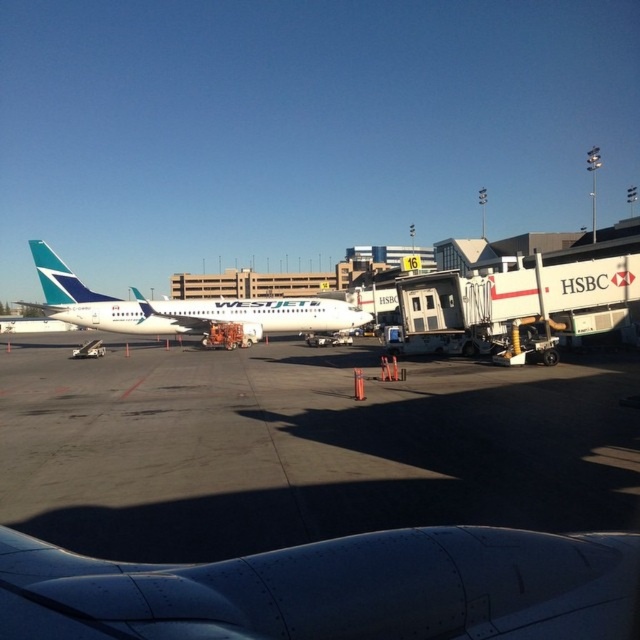
Is metallic gray engine at lower center shorter than white glossy airplane at center?

Yes.

Which is more to the right, metallic gray engine at lower center or white glossy airplane at center?

Positioned to the right is metallic gray engine at lower center.

Does point (266, 616) come in front of point (291, 300)?

Yes, it is.

The image size is (640, 640). I want to click on metallic gray engine at lower center, so click(x=333, y=589).